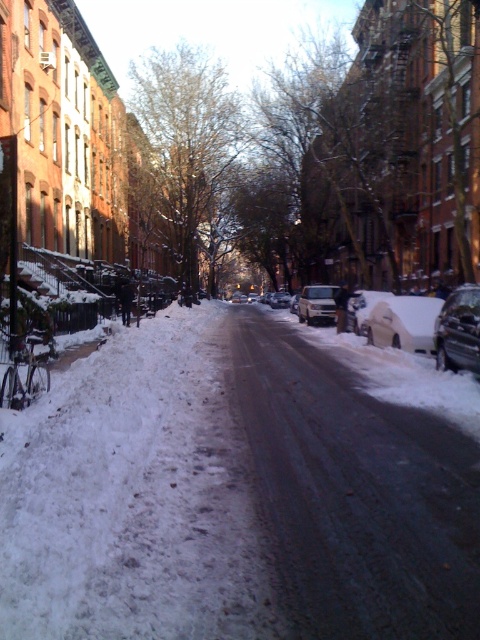
Question: Is satin silver sedan at center below silver metallic van at center?

Choices:
 (A) no
 (B) yes

Answer: (A)

Question: Does white matte car at right have a lesser width compared to silver metallic van at center?

Choices:
 (A) no
 (B) yes

Answer: (B)

Question: Estimate the real-world distances between objects in this image. Which object is closer to the white matte car at right?

Choices:
 (A) satin silver sedan at center
 (B) shiny black car at right

Answer: (B)

Question: Which object is positioned closest to the shiny black car at right?

Choices:
 (A) silver metallic van at center
 (B) satin silver sedan at center
 (C) white matte car at right

Answer: (C)

Question: Which is farther from the satin silver sedan at center?

Choices:
 (A) silver metallic van at center
 (B) shiny black car at right
 (C) white matte car at right

Answer: (B)

Question: Observing the image, what is the correct spatial positioning of shiny black car at right in reference to satin silver sedan at center?

Choices:
 (A) left
 (B) right

Answer: (A)